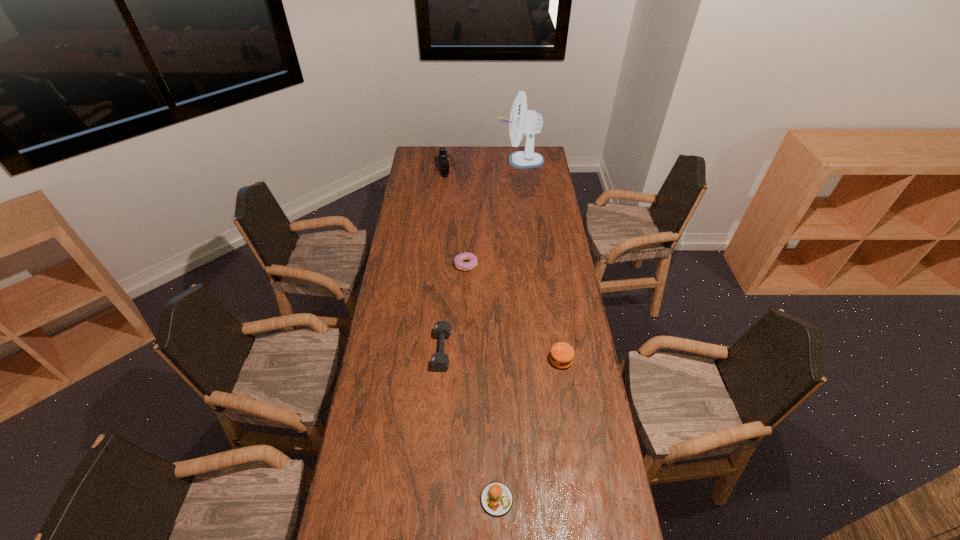
Image resolution: width=960 pixels, height=540 pixels. In order to click on vacant space that's between the fan and the doughnut in this screenshot , I will do (x=492, y=212).

I want to click on vacant area that lies between the fifth shortest object and the shorter patty, so click(470, 333).

The height and width of the screenshot is (540, 960). In order to click on free space between the farther patty and the tallest object in this screenshot , I will do `click(540, 260)`.

In order to click on free area in between the doughnut and the farther patty in this screenshot , I will do `click(514, 313)`.

What are the coordinates of `free spot between the fourth nearest object and the tallest object` in the screenshot? It's located at (492, 212).

Locate an element on the screen. unoccupied position between the dumbbell and the farther patty is located at coordinates (501, 355).

Identify the location of unoccupied position between the dumbbell and the tallest object. (481, 255).

Where is `the second closest object to the fan`? the second closest object to the fan is located at coordinates [458, 260].

Locate which object is the second closest to the doughnut. Please provide its 2D coordinates. Your answer should be formatted as a tuple, i.e. [(x, y)], where the tuple contains the x and y coordinates of a point satisfying the conditions above.

[(562, 354)]

I want to click on free region that satisfies the following two spatial constraints: 1. on the front side of the farther patty; 2. on the left side of the third farthest object, so click(463, 360).